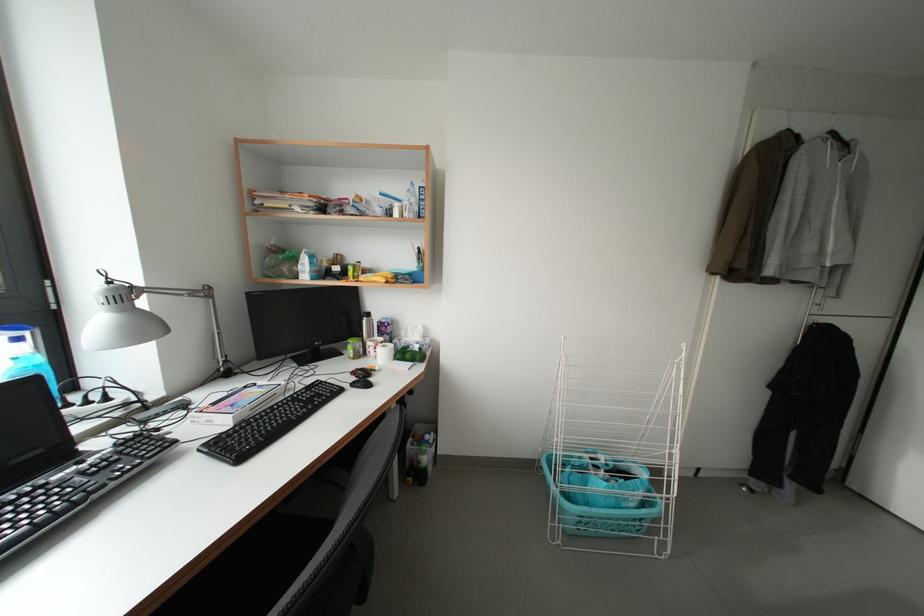
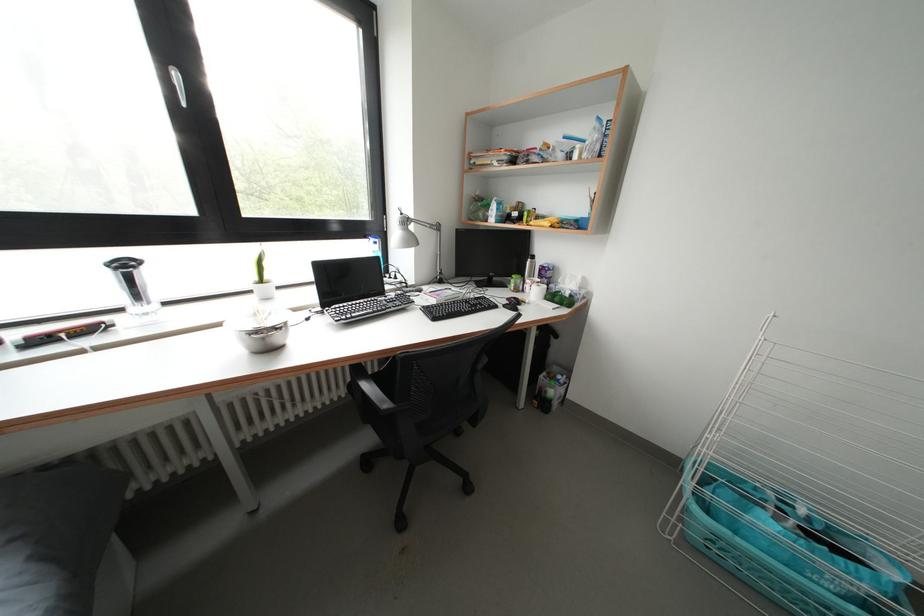
Locate, in the second image, the point that corresponds to point (116, 286) in the first image.

(408, 219)